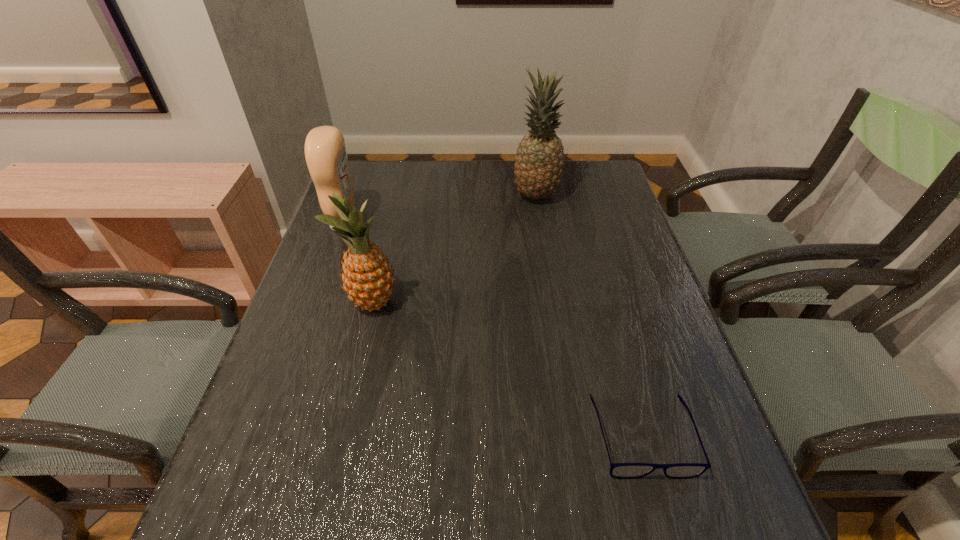
Find the location of `the tallest object`. the tallest object is located at coordinates (539, 163).

The image size is (960, 540). In order to click on the taller pineapple in this screenshot , I will do `click(539, 163)`.

The image size is (960, 540). I want to click on the nearer pineapple, so click(x=368, y=279).

Identify the location of the third farthest object. The image size is (960, 540). click(368, 279).

Where is `the leftmost object`? The image size is (960, 540). the leftmost object is located at coordinates (325, 151).

In order to click on spectacles in this screenshot , I will do `click(617, 470)`.

Where is `the nearest object`? The height and width of the screenshot is (540, 960). the nearest object is located at coordinates (617, 470).

The image size is (960, 540). I want to click on vacant region located 0.260m on the front of the farther pineapple, so point(547,269).

Identify the location of free location located on the back of the nearer pineapple. The height and width of the screenshot is (540, 960). (397, 202).

Image resolution: width=960 pixels, height=540 pixels. Find the location of `free space located 0.330m on the label of the condiment`. free space located 0.330m on the label of the condiment is located at coordinates (474, 224).